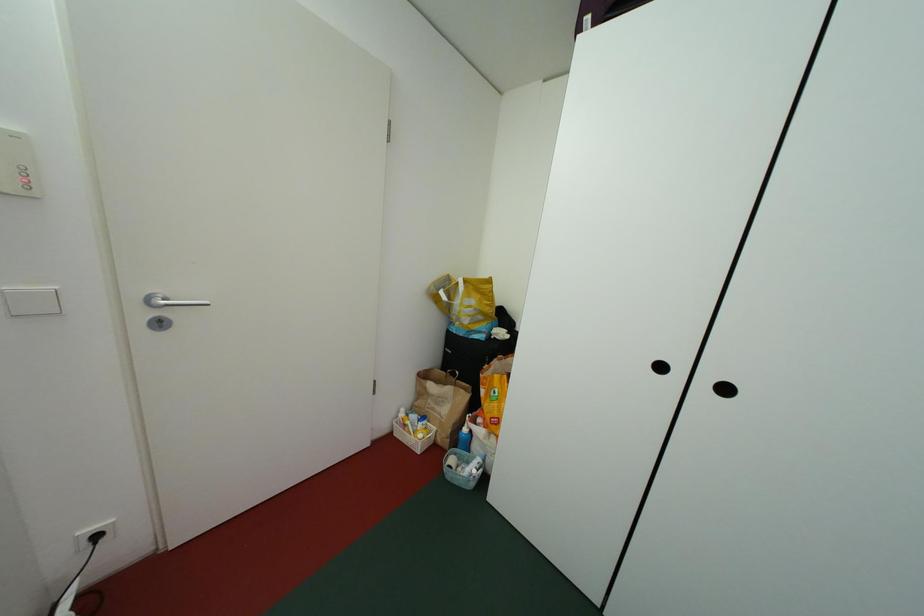
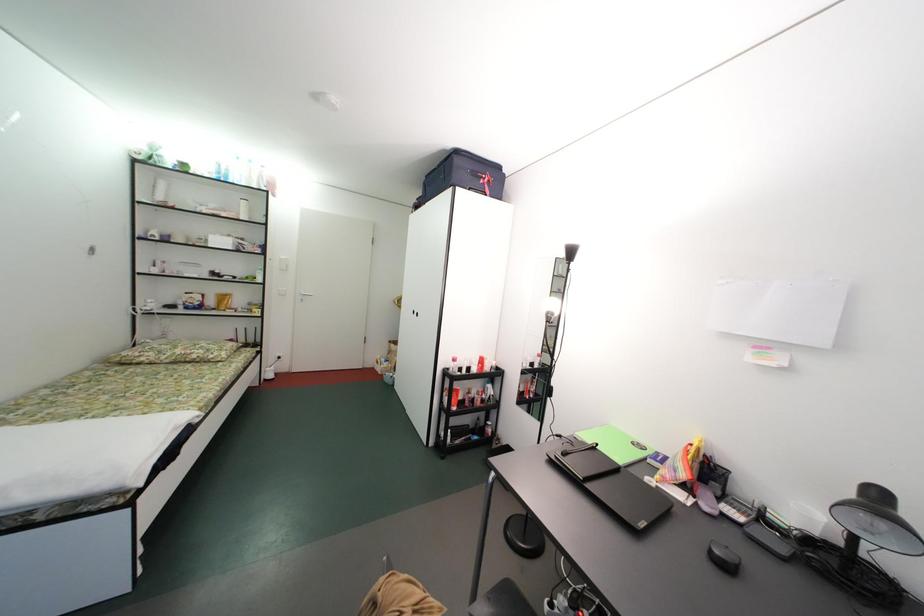
The images are taken continuously from a first-person perspective. In which direction are you moving?

The cameraman moved toward right, backward.